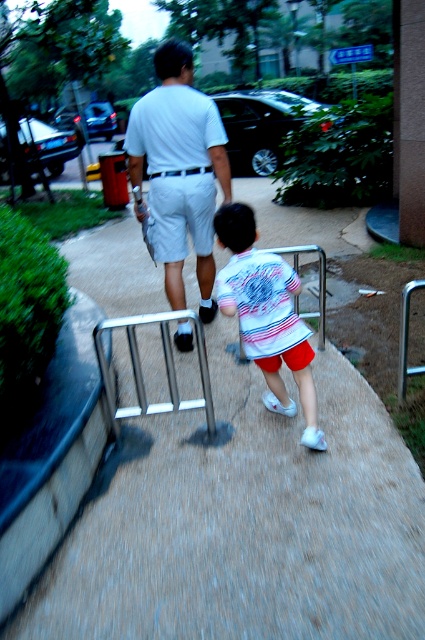
Measure the distance between white printed shirt at center and white cotton shorts at center.

white printed shirt at center and white cotton shorts at center are 36.61 inches apart.

Which is in front, point (226, 282) or point (176, 257)?

Point (226, 282)

What do you see at coordinates (266, 316) in the screenshot?
I see `white printed shirt at center` at bounding box center [266, 316].

Find the location of a particular element. This screenshot has height=640, width=425. white printed shirt at center is located at coordinates (266, 316).

Can you confirm if white printed shirt at center is shorter than silver metallic rail at center?

No.

Does point (297, 387) come closer to viewer compared to point (129, 324)?

No, it is behind (129, 324).

Identify the location of white printed shirt at center. The image size is (425, 640). (266, 316).

Between gray concrete pavement at center and white cotton shorts at center, which one is positioned higher?

white cotton shorts at center is higher up.

Is gray concrete pavement at center taller than white cotton shorts at center?

Yes, gray concrete pavement at center is taller than white cotton shorts at center.

Describe the element at coordinates (246, 524) in the screenshot. I see `gray concrete pavement at center` at that location.

This screenshot has height=640, width=425. Identify the location of gray concrete pavement at center. (246, 524).